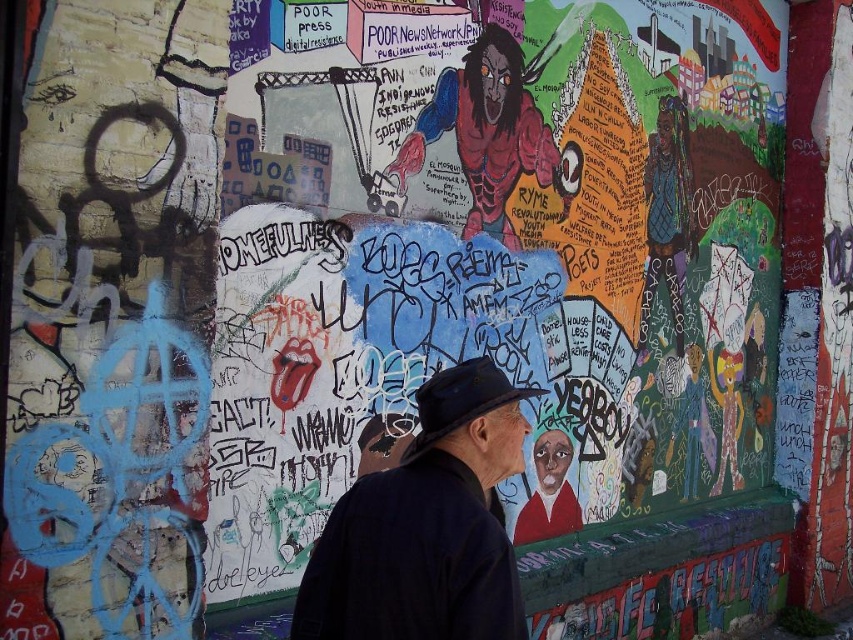
Question: Which object is positioned farthest from the dark blue hat at center?

Choices:
 (A) black felt hat at center
 (B) dark blue fabric jacket at center

Answer: (B)

Question: Is black felt hat at center bigger than dark blue hat at center?

Choices:
 (A) no
 (B) yes

Answer: (B)

Question: Is black felt hat at center positioned at the back of dark blue hat at center?

Choices:
 (A) no
 (B) yes

Answer: (B)

Question: Which of the following is the farthest from the observer?

Choices:
 (A) (483, 392)
 (B) (500, 432)

Answer: (B)

Question: Does dark blue fabric jacket at center lie behind black felt hat at center?

Choices:
 (A) yes
 (B) no

Answer: (B)

Question: Which point is farther to the camera?

Choices:
 (A) dark blue hat at center
 (B) dark blue fabric jacket at center
 (C) matte black hat at center

Answer: (C)